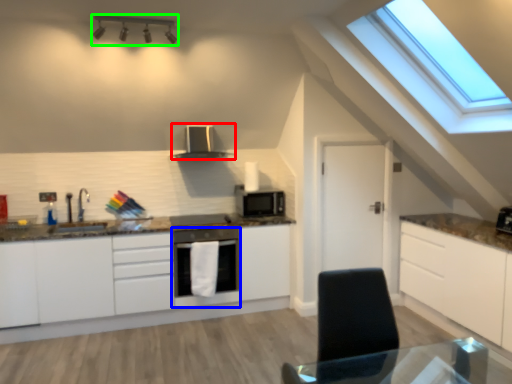
Question: Which object is positioned farthest from kitchen appliance (highlighted by a red box)? Select from home appliance (highlighted by a blue box) and light fixture (highlighted by a green box).

Choices:
 (A) home appliance
 (B) light fixture

Answer: (B)